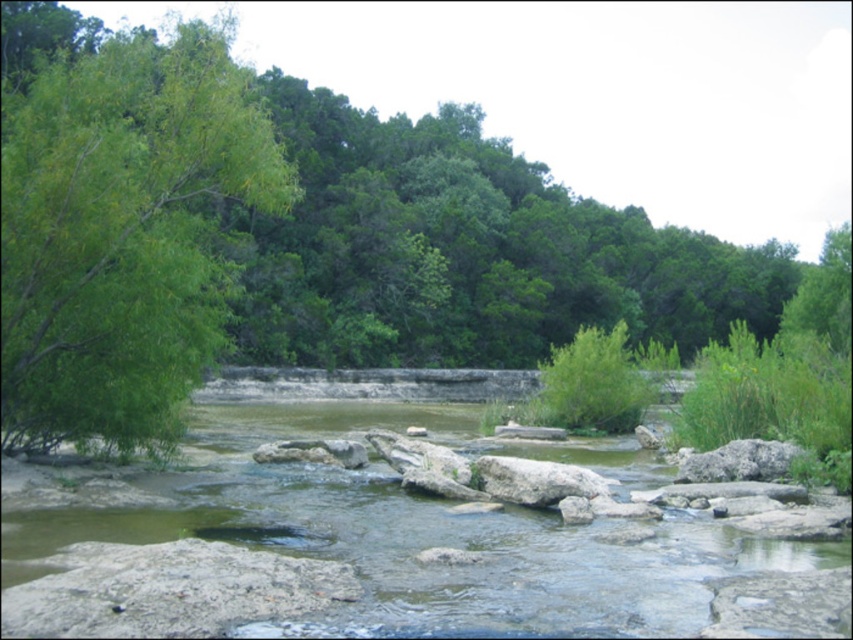
You are standing at the edge of the green stone river at center and want to reach the green leafy tree at left. Which direction should you walk to get closer to the tree?

The green leafy tree at left is larger in size than the green stone river at center, so you should walk towards the left direction to get closer to the tree.

You are standing at the center of the image. Which direction should you move to reach the green stone river at center?

The green stone river at center is located at coordinates point [403,529], so you should move towards the right direction from the center to reach it.